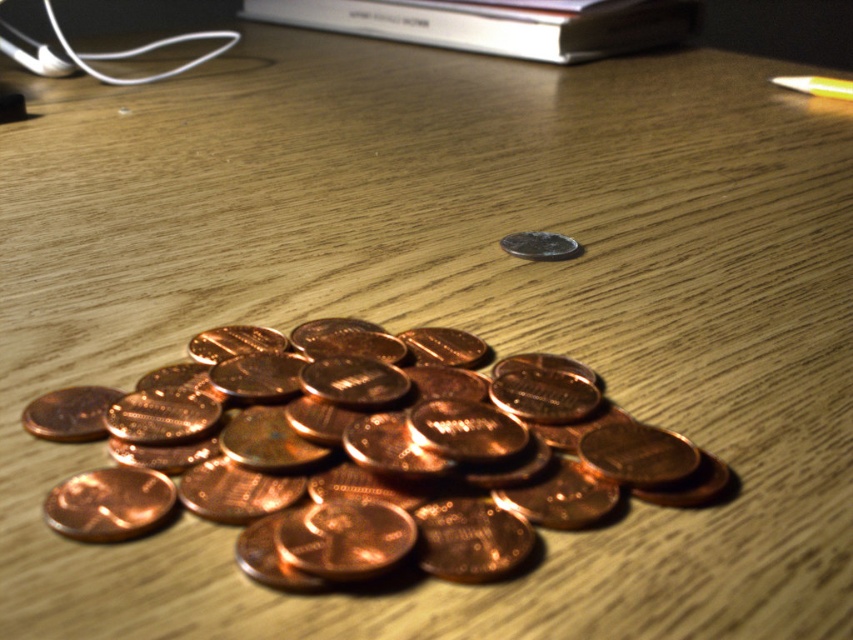
Does copper metallic coins at center lie behind shiny silver coin at center?

That is False.

Can you confirm if copper metallic coins at center is positioned to the left of shiny silver coin at center?

Correct, you'll find copper metallic coins at center to the left of shiny silver coin at center.

Does point (393, 547) lie behind point (515, 248)?

No, it is not.

The image size is (853, 640). I want to click on copper metallic coins at center, so click(x=364, y=456).

Does point (492, 36) come in front of point (532, 253)?

No, (492, 36) is further to viewer.

Who is shorter, silver metallic book at upper center or shiny silver coin at center?

Standing shorter between the two is shiny silver coin at center.

What do you see at coordinates (497, 22) in the screenshot? The width and height of the screenshot is (853, 640). I see `silver metallic book at upper center` at bounding box center [497, 22].

You are a GUI agent. You are given a task and a screenshot of the screen. Output one action in this format:
    pyautogui.click(x=<x>, y=<y>)
    Task: Click on the silver metallic book at upper center
    Image resolution: width=853 pixels, height=640 pixels.
    Given the screenshot: What is the action you would take?
    pyautogui.click(x=497, y=22)

Is point (695, 12) positioned before point (801, 83)?

No, (695, 12) is behind (801, 83).

Who is more distant from viewer, (634, 44) or (782, 81)?

The point (634, 44) is behind.

The width and height of the screenshot is (853, 640). Identify the location of silver metallic book at upper center. (497, 22).